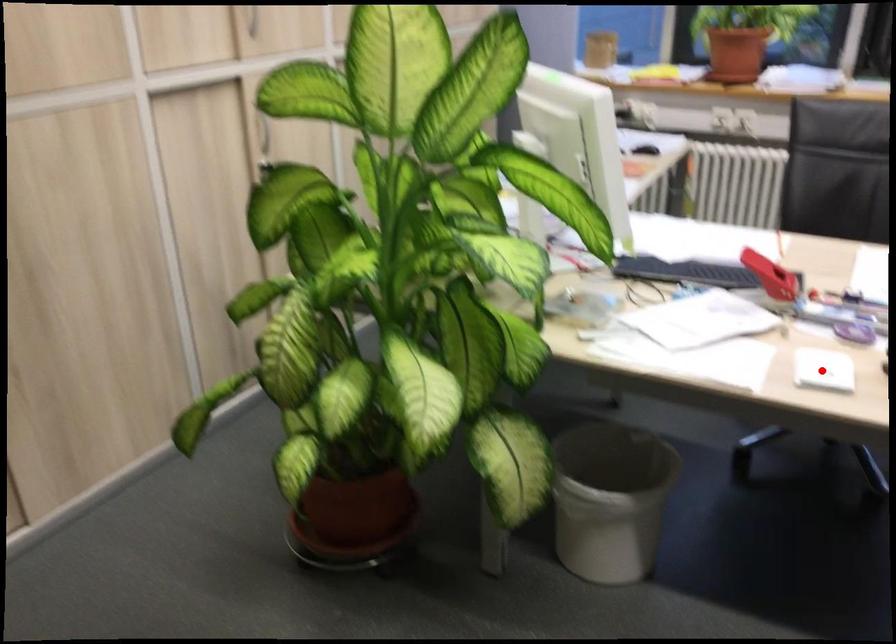
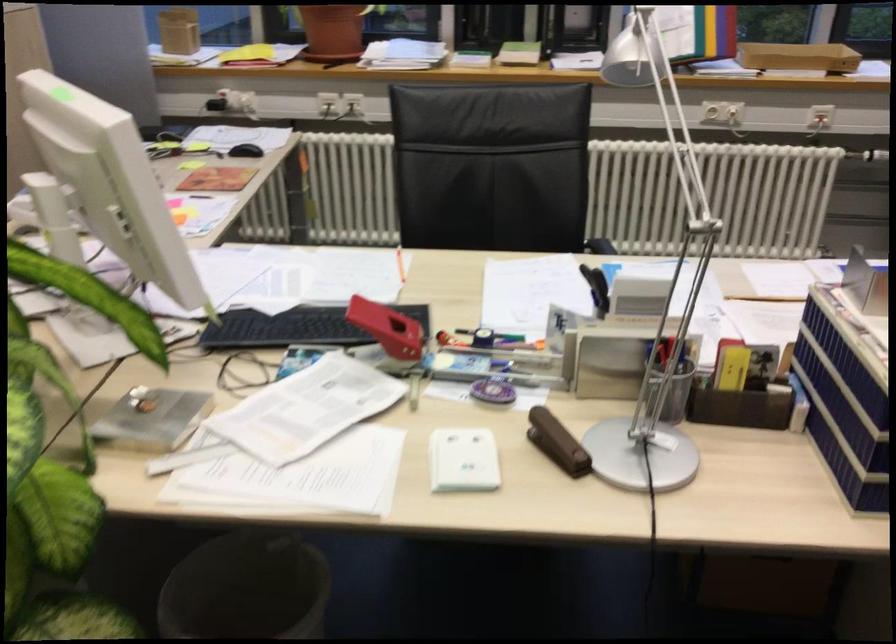
Question: I am providing you with two images of the same scene from different viewpoints. In image1, a red point is highlighted. Considering the same 3D point in image2, which of the following is correct?

Choices:
 (A) It is closer
 (B) It is farther

Answer: (A)